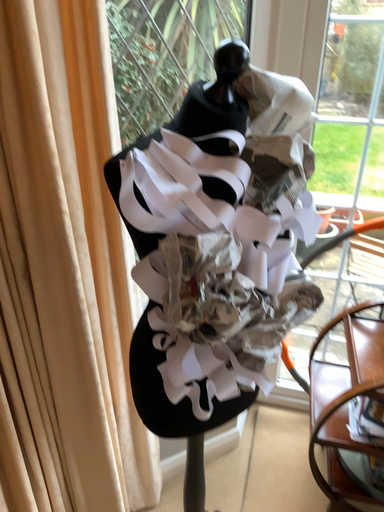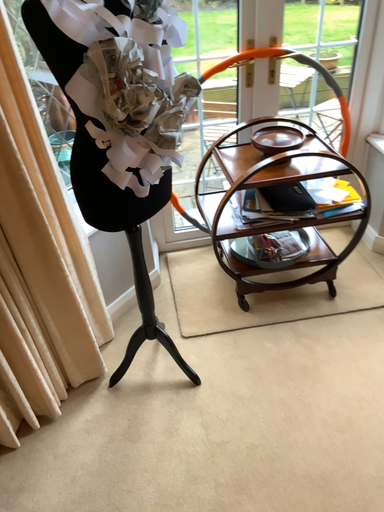
Question: How did the camera likely rotate when shooting the video?

Choices:
 (A) rotated upward
 (B) rotated downward

Answer: (B)